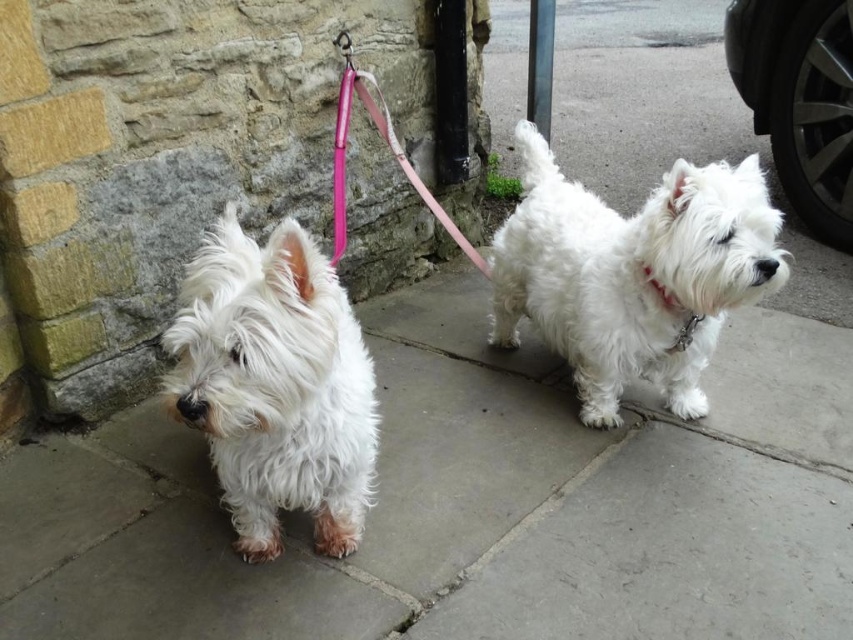
Is black rubber tire at right thinner than pink fabric leash at center?

Correct, black rubber tire at right's width is less than pink fabric leash at center's.

Is point (840, 164) closer to camera compared to point (376, 108)?

No, it is behind (376, 108).

Is point (845, 209) positioned in front of point (337, 106)?

No, it is behind (337, 106).

I want to click on black rubber tire at right, so click(x=799, y=100).

Is white stone pavement at center smaller than white fabric neckband at center right?

No, white stone pavement at center is not smaller than white fabric neckband at center right.

Who is lower down, white stone pavement at center or white fabric neckband at center right?

white stone pavement at center is below.

Who is more forward, [500,488] or [659,291]?

Positioned in front is point [659,291].

I want to click on white stone pavement at center, so click(x=471, y=502).

Between white stone pavement at center and black rubber tire at right, which one has more height?

black rubber tire at right is taller.

Locate an element on the screen. white stone pavement at center is located at coordinates (471, 502).

This screenshot has width=853, height=640. What are the coordinates of `white stone pavement at center` in the screenshot? It's located at (471, 502).